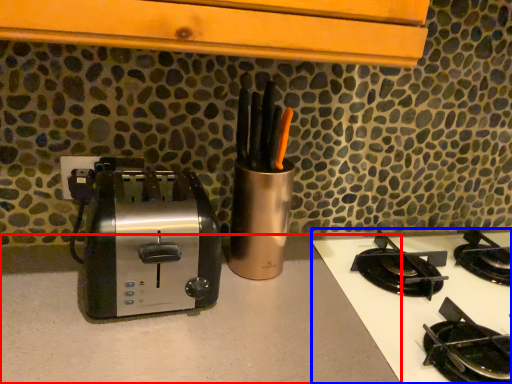
Question: Among these objects, which one is farthest to the camera, counter top (highlighted by a red box) or gas stove (highlighted by a blue box)?

Choices:
 (A) counter top
 (B) gas stove

Answer: (B)